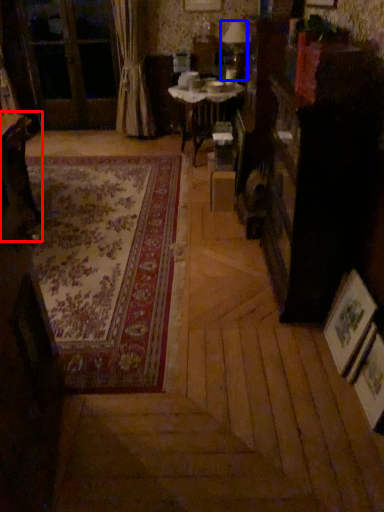
Question: Which object appears farthest to the camera in this image, table (highlighted by a red box) or table lamp (highlighted by a blue box)?

Choices:
 (A) table
 (B) table lamp

Answer: (B)